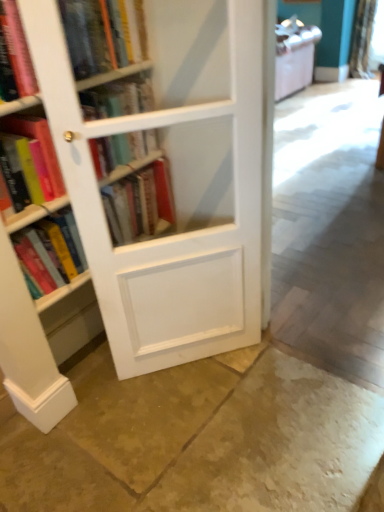
Question: Is white wood bookcase at left further to camera compared to white sheer curtain at upper right?

Choices:
 (A) yes
 (B) no

Answer: (B)

Question: From the image's perspective, is white wood bookcase at left beneath white sheer curtain at upper right?

Choices:
 (A) yes
 (B) no

Answer: (A)

Question: Can you confirm if white wood bookcase at left is smaller than white sheer curtain at upper right?

Choices:
 (A) no
 (B) yes

Answer: (B)

Question: Considering the relative sizes of white wood bookcase at left and white sheer curtain at upper right in the image provided, is white wood bookcase at left thinner than white sheer curtain at upper right?

Choices:
 (A) yes
 (B) no

Answer: (A)

Question: From a real-world perspective, is white wood bookcase at left on top of white sheer curtain at upper right?

Choices:
 (A) no
 (B) yes

Answer: (B)

Question: Is smooth stone floor at center, which is the 1th concrete from bottom to top, wider or thinner than white wood bookcase at left?

Choices:
 (A) wide
 (B) thin

Answer: (A)

Question: In terms of size, does smooth stone floor at center, which is the 1th concrete from bottom to top, appear bigger or smaller than white wood bookcase at left?

Choices:
 (A) small
 (B) big

Answer: (A)

Question: Is smooth stone floor at center, which is the 1th concrete from bottom to top, taller or shorter than white wood bookcase at left?

Choices:
 (A) short
 (B) tall

Answer: (A)

Question: From a real-world perspective, relative to white wood bookcase at left, is smooth stone floor at center, which is the 1th concrete from bottom to top, vertically above or below?

Choices:
 (A) above
 (B) below

Answer: (B)

Question: Choose the correct answer: Is smooth concrete floor at center, arranged as the first concrete when viewed from the top, inside matte pink book at left, placed as the fifth book when sorted from bottom to top, or outside it?

Choices:
 (A) inside
 (B) outside

Answer: (B)

Question: From the image's perspective, is smooth concrete floor at center, arranged as the first concrete when viewed from the top, located above or below matte pink book at left, placed as the fifth book when sorted from bottom to top?

Choices:
 (A) below
 (B) above

Answer: (A)

Question: Is point (327, 254) positioned closer to the camera than point (11, 57)?

Choices:
 (A) closer
 (B) farther

Answer: (B)

Question: Based on their sizes in the image, would you say smooth concrete floor at center, arranged as the first concrete when viewed from the top, is bigger or smaller than matte pink book at left, placed as the 2th book when sorted from top to bottom?

Choices:
 (A) big
 (B) small

Answer: (A)

Question: Looking at their shapes, would you say hardcover book at left, which appears as the fourth book when viewed from the top, is wider or thinner than matte pink book at left, placed as the 2th book when sorted from top to bottom?

Choices:
 (A) thin
 (B) wide

Answer: (B)

Question: Is hardcover book at left, arranged as the third book when ordered from the bottom, to the left or to the right of matte pink book at left, placed as the 2th book when sorted from top to bottom, in the image?

Choices:
 (A) left
 (B) right

Answer: (A)